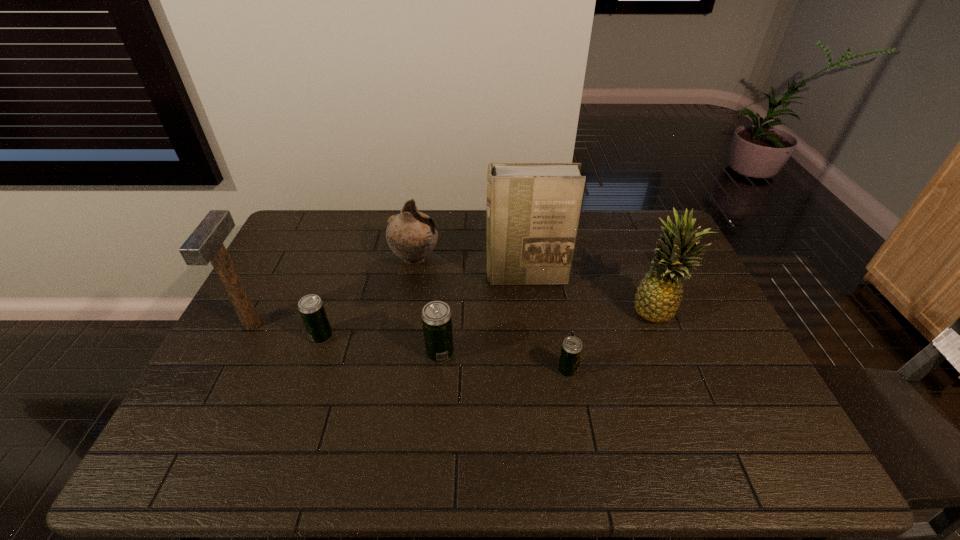
Where is `vacant area located on the back of the second object from left to right`? The image size is (960, 540). vacant area located on the back of the second object from left to right is located at coordinates (340, 285).

Image resolution: width=960 pixels, height=540 pixels. I want to click on free space located on the right of the second beer can from right to left, so click(480, 353).

The height and width of the screenshot is (540, 960). I want to click on free space located on the back of the rightmost beer can, so click(552, 284).

The width and height of the screenshot is (960, 540). What are the coordinates of `free location located on the cover of the phonebook` in the screenshot? It's located at (534, 341).

You are a GUI agent. You are given a task and a screenshot of the screen. Output one action in this format:
    pyautogui.click(x=<x>, y=<y>)
    Task: Click on the vacant space located on the back of the pineapple
    
    Given the screenshot: What is the action you would take?
    pyautogui.click(x=624, y=231)

Find the location of `vacant space located on the back of the mallet`. vacant space located on the back of the mallet is located at coordinates (283, 264).

Locate an element on the screen. This screenshot has height=540, width=960. free space located from the spout of the fourth tallest object is located at coordinates (478, 259).

Where is `object that is at the far edge`? This screenshot has height=540, width=960. object that is at the far edge is located at coordinates (412, 235).

Find the location of a particular element. The image size is (960, 540). object located in the left edge section of the desktop is located at coordinates (205, 244).

The width and height of the screenshot is (960, 540). I want to click on object that is positioned at the right edge, so click(658, 296).